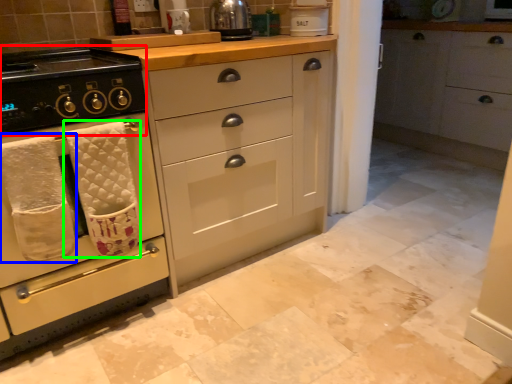
Question: Estimate the real-world distances between objects in this image. Which object is closer to gas stove (highlighted by a red box), bath towel (highlighted by a blue box) or bath towel (highlighted by a green box)?

Choices:
 (A) bath towel
 (B) bath towel

Answer: (B)